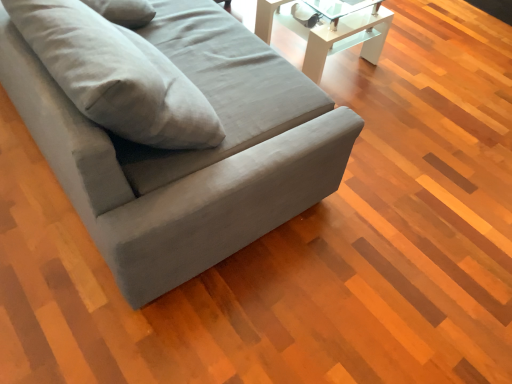
Question: From a real-world perspective, is white glossy table at upper center positioned above or below matte gray couch at center?

Choices:
 (A) below
 (B) above

Answer: (A)

Question: Which is correct: white glossy table at upper center is inside matte gray couch at center, or outside of it?

Choices:
 (A) outside
 (B) inside

Answer: (A)

Question: Based on their sizes in the image, would you say white glossy table at upper center is bigger or smaller than matte gray couch at center?

Choices:
 (A) small
 (B) big

Answer: (A)

Question: Does point (74, 107) appear closer or farther from the camera than point (321, 54)?

Choices:
 (A) farther
 (B) closer

Answer: (B)

Question: In the image, is matte gray couch at center on the left side or the right side of white glossy table at upper center?

Choices:
 (A) left
 (B) right

Answer: (A)

Question: Considering the positions of matte gray couch at center and white glossy table at upper center in the image, is matte gray couch at center wider or thinner than white glossy table at upper center?

Choices:
 (A) wide
 (B) thin

Answer: (A)

Question: Considering the positions of matte gray couch at center and white glossy table at upper center in the image, is matte gray couch at center taller or shorter than white glossy table at upper center?

Choices:
 (A) tall
 (B) short

Answer: (A)